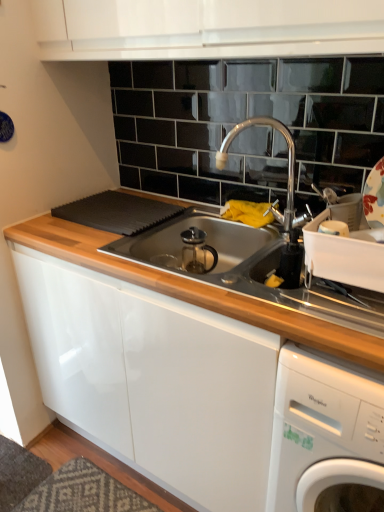
Question: Is polished chrome faucet at upper center in front of or behind white glossy washing machine at lower right in the image?

Choices:
 (A) behind
 (B) front

Answer: (A)

Question: Based on their sizes in the image, would you say polished chrome faucet at upper center is bigger or smaller than white glossy washing machine at lower right?

Choices:
 (A) big
 (B) small

Answer: (B)

Question: Is polished chrome faucet at upper center inside the boundaries of white glossy washing machine at lower right, or outside?

Choices:
 (A) outside
 (B) inside

Answer: (A)

Question: From their relative heights in the image, would you say white glossy washing machine at lower right is taller or shorter than polished chrome faucet at upper center?

Choices:
 (A) tall
 (B) short

Answer: (A)

Question: Does point (319, 358) appear closer or farther from the camera than point (288, 194)?

Choices:
 (A) farther
 (B) closer

Answer: (B)

Question: From a real-world perspective, is white glossy washing machine at lower right positioned above or below polished chrome faucet at upper center?

Choices:
 (A) above
 (B) below

Answer: (B)

Question: From the image's perspective, relative to polished chrome faucet at upper center, is white glossy washing machine at lower right above or below?

Choices:
 (A) below
 (B) above

Answer: (A)